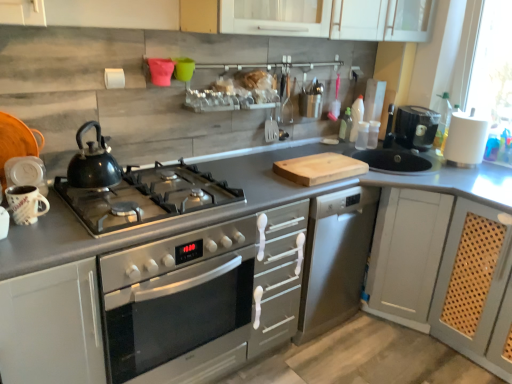
Find the location of a particular element. This screenshot has height=384, width=512. blank space situated above black plastic coffee machine at right (from a real-world perspective) is located at coordinates (423, 112).